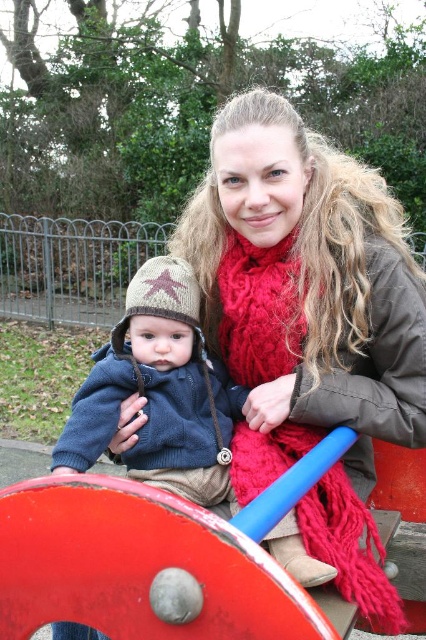
Question: Which point is farther to the camera?

Choices:
 (A) red knitted scarf at center
 (B) knitted brown hat at center

Answer: (A)

Question: Is knitted brown hat at center smaller than red knitted scarf at center?

Choices:
 (A) no
 (B) yes

Answer: (B)

Question: Which point is closer to the camera?

Choices:
 (A) (181, 429)
 (B) (267, 356)

Answer: (A)

Question: Which of the following is the closest to the observer?

Choices:
 (A) knitted brown hat at center
 (B) red knitted scarf at center

Answer: (A)

Question: Does knitted brown hat at center appear under red knitted scarf at center?

Choices:
 (A) no
 (B) yes

Answer: (A)

Question: Is knitted brown hat at center bigger than red knitted scarf at center?

Choices:
 (A) yes
 (B) no

Answer: (B)